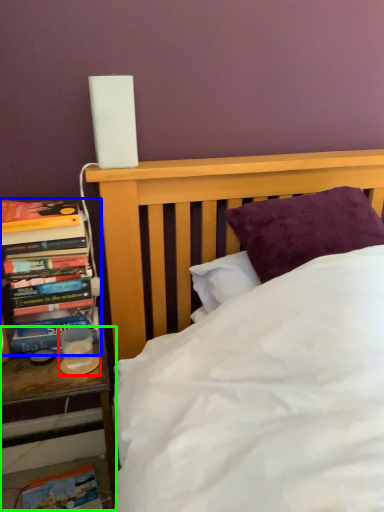
Question: Which object is the closest to the candle holder (highlighted by a red box)? Choose among these: book (highlighted by a blue box) or nightstand (highlighted by a green box).

Choices:
 (A) book
 (B) nightstand

Answer: (B)